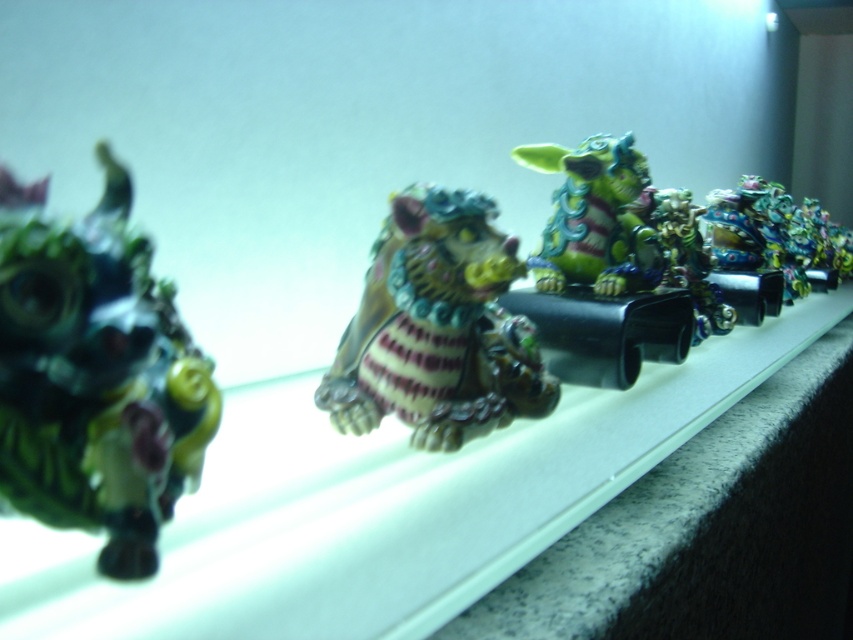
Question: Which object is farther from the camera taking this photo?

Choices:
 (A) shiny ceramic tiger at center
 (B) metallic gold dragon at center
 (C) shiny metallic dragon at right

Answer: (C)

Question: Can you confirm if shiny ceramic tiger at center is thinner than shiny green and purple figurine at center?

Choices:
 (A) yes
 (B) no

Answer: (B)

Question: Among these objects, which one is nearest to the camera?

Choices:
 (A) shiny metallic dragon at right
 (B) shiny green plastic dragon at left
 (C) metallic gold dragon at center
 (D) shiny ceramic tiger at center

Answer: (B)

Question: Which point is farther from the camera taking this photo?

Choices:
 (A) (549, 256)
 (B) (705, 314)
 (C) (521, 273)

Answer: (B)

Question: Can you confirm if shiny ceramic tiger at center is positioned to the left of shiny metallic dragon at right?

Choices:
 (A) yes
 (B) no

Answer: (A)

Question: Is shiny ceramic tiger at center below metallic gold dragon at center?

Choices:
 (A) no
 (B) yes

Answer: (B)